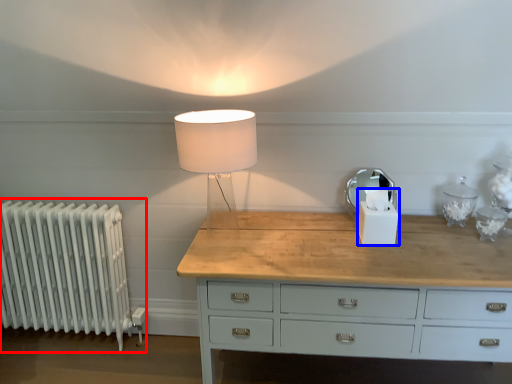
Question: Which object appears farthest to the camera in this image, radiator (highlighted by a red box) or candle holder (highlighted by a blue box)?

Choices:
 (A) radiator
 (B) candle holder

Answer: (A)